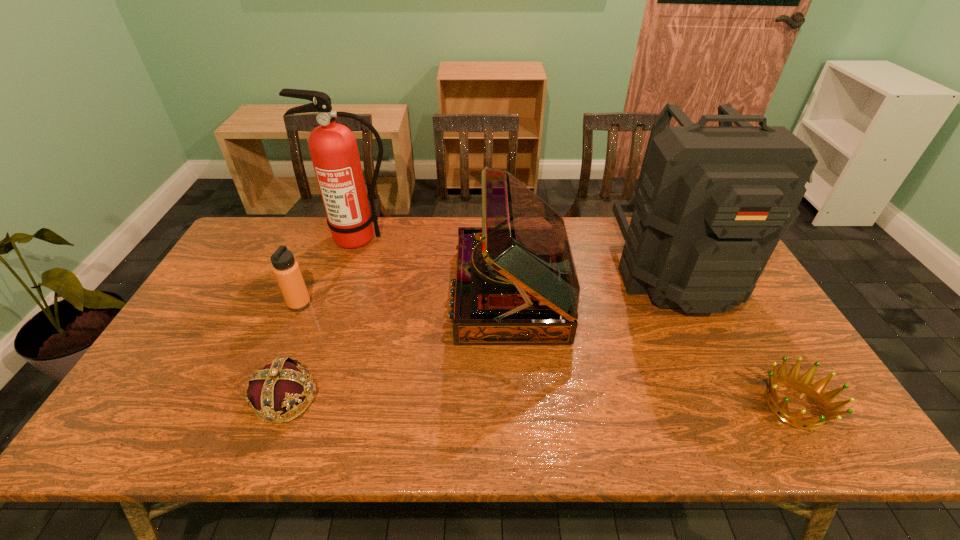
You are a GUI agent. You are given a task and a screenshot of the screen. Output one action in this format:
    pyautogui.click(x=<x>, y=<y>)
    Task: Click on the fire extinguisher
    The height and width of the screenshot is (540, 960).
    Given the screenshot: What is the action you would take?
    (x=333, y=148)

Identify the location of backpack. The image size is (960, 540). (712, 202).

At what (x,y) coordinates should I click in order to perform the action: click on the third object from right to left. Please return your answer as a coordinate pair (x, y). This screenshot has height=540, width=960. Looking at the image, I should click on (516, 283).

Identify the location of record player. (516, 283).

Find the location of a particular element. The width and height of the screenshot is (960, 540). the third shortest object is located at coordinates click(285, 268).

The height and width of the screenshot is (540, 960). I want to click on the second shortest object, so click(x=279, y=386).

I want to click on the left crown, so click(279, 386).

Locate an element on the screen. The width and height of the screenshot is (960, 540). the shortest object is located at coordinates (815, 392).

Identify the location of the shorter crown. (815, 392).

Where is `free space located 0.340m on the handle side of the fire extinguisher`? free space located 0.340m on the handle side of the fire extinguisher is located at coordinates (328, 330).